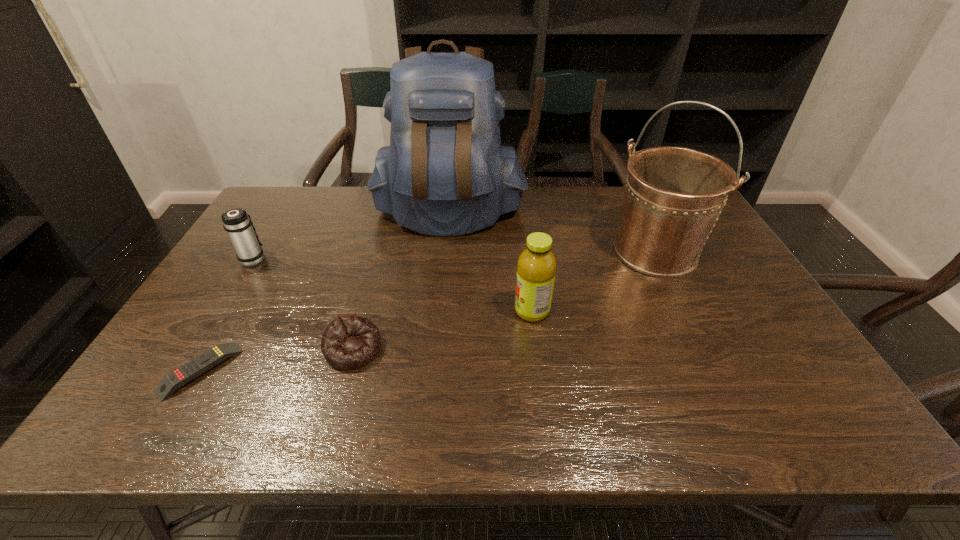
I want to click on free space that is in between the fruit juice and the thermos bottle, so click(x=393, y=285).

The width and height of the screenshot is (960, 540). Find the location of `free area in between the beanbag and the fourth shortest object`. free area in between the beanbag and the fourth shortest object is located at coordinates (443, 330).

The height and width of the screenshot is (540, 960). I want to click on vacant area between the bucket and the remote control, so click(x=427, y=311).

At what (x,y) coordinates should I click in order to perform the action: click on vacant space in between the rightmost object and the fruit juice. Please return your answer as a coordinate pair (x, y). Looking at the image, I should click on (593, 281).

What are the coordinates of `vacant space that's between the second shortest object and the fourth shortest object` in the screenshot? It's located at (443, 330).

Locate an element on the screen. This screenshot has height=540, width=960. empty space between the fourth shortest object and the fifth tallest object is located at coordinates (443, 330).

Locate an element on the screen. The image size is (960, 540). free point between the beanbag and the thermos bottle is located at coordinates (303, 304).

Locate an element on the screen. This screenshot has height=540, width=960. the fourth closest object to the second shortest object is located at coordinates (445, 173).

Identify which object is the fourth nearest to the third shortest object. Please provide its 2D coordinates. Your answer should be formatted as a tuple, i.e. [(x, y)], where the tuple contains the x and y coordinates of a point satisfying the conditions above.

[(536, 267)]

The image size is (960, 540). I want to click on vacant space that satisfies the following two spatial constraints: 1. on the back side of the bucket; 2. on the right side of the remote control, so click(270, 252).